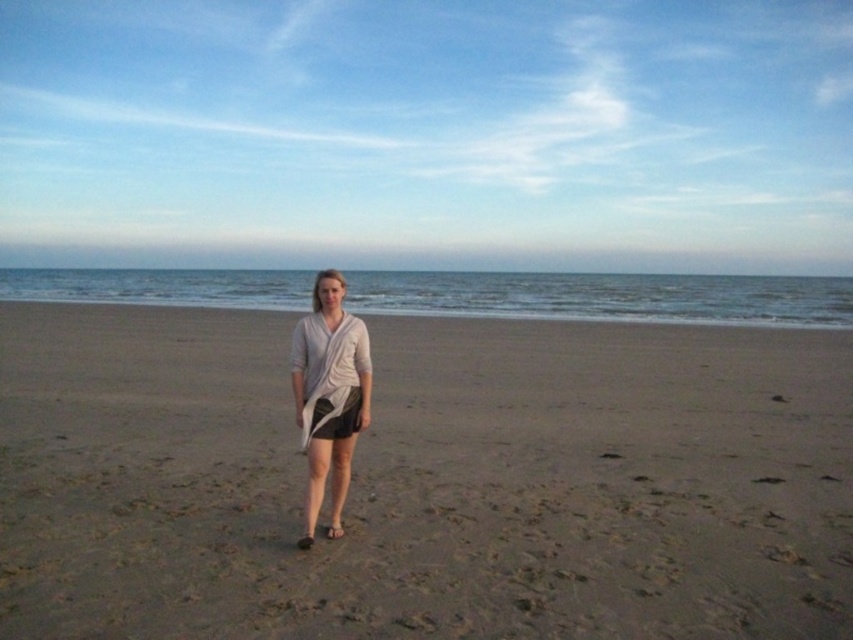
Question: Which object is farther from the camera taking this photo?

Choices:
 (A) light gray draped fabric at center
 (B) brown sandy beach at center

Answer: (A)

Question: Is brown sandy beach at center above light gray draped fabric at center?

Choices:
 (A) no
 (B) yes

Answer: (A)

Question: Does brown sandy beach at center have a greater width compared to light gray draped fabric at center?

Choices:
 (A) no
 (B) yes

Answer: (B)

Question: Which object appears farthest from the camera in this image?

Choices:
 (A) light gray draped fabric at center
 (B) brown sandy beach at center

Answer: (A)

Question: Is brown sandy beach at center above light gray draped fabric at center?

Choices:
 (A) yes
 (B) no

Answer: (B)